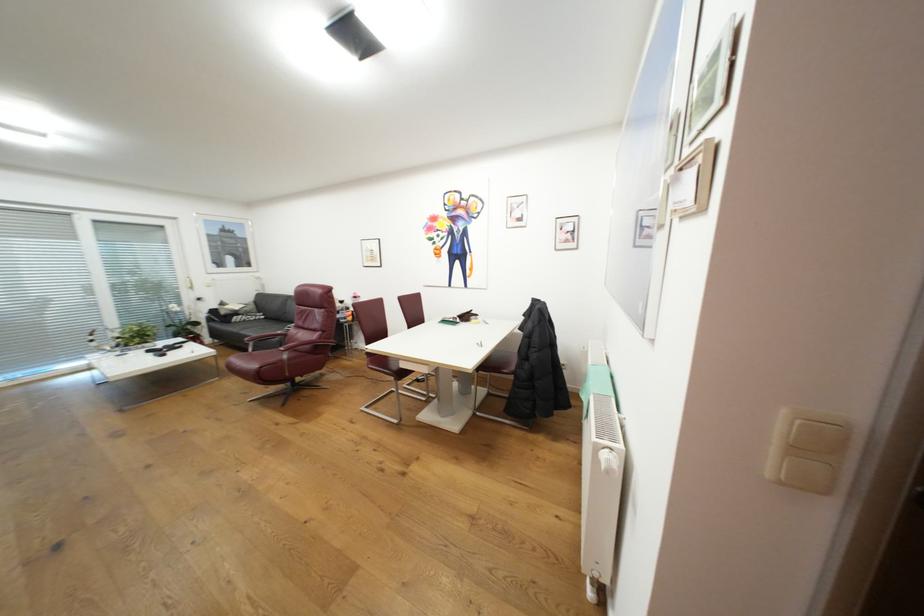
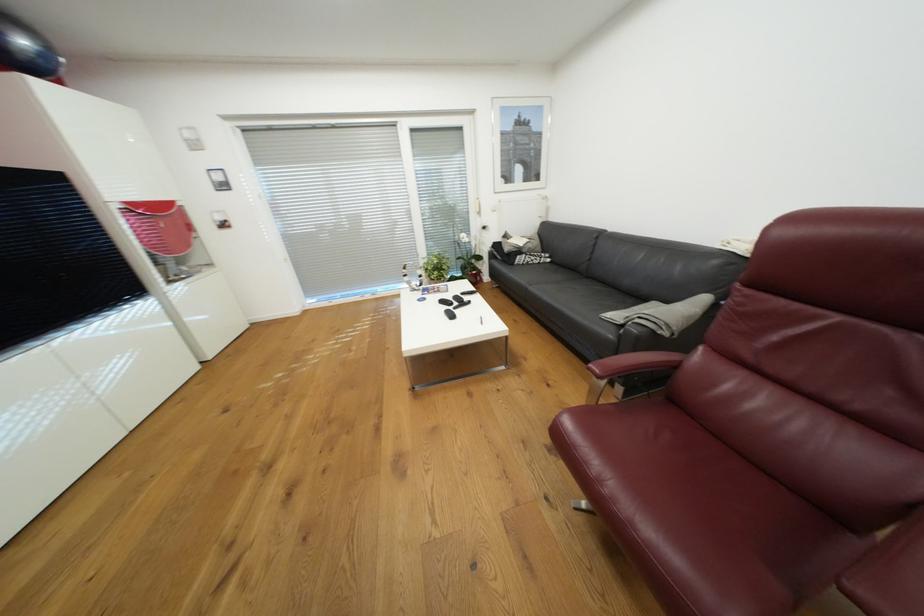
Find the pixel in the second image that matches point (242, 313) in the first image.

(526, 252)